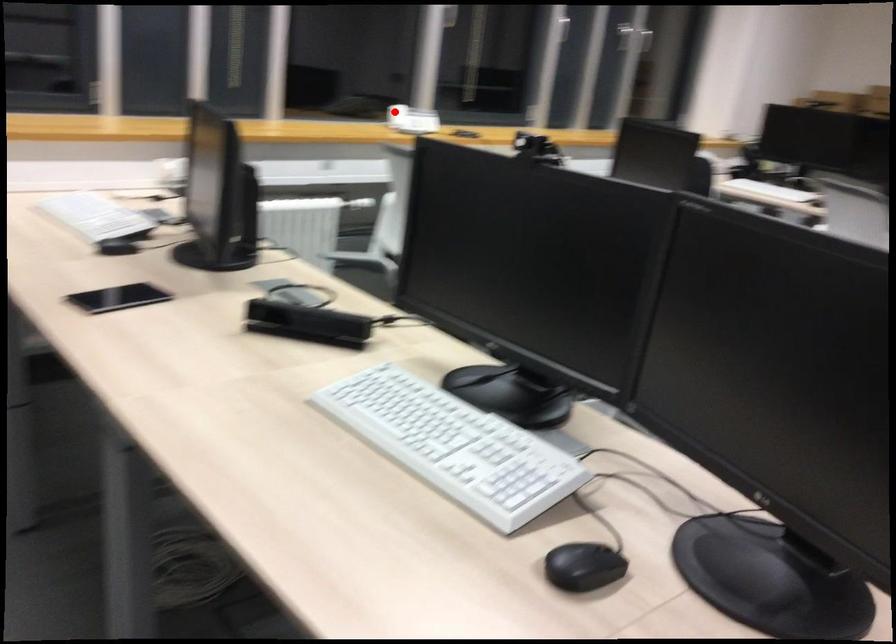
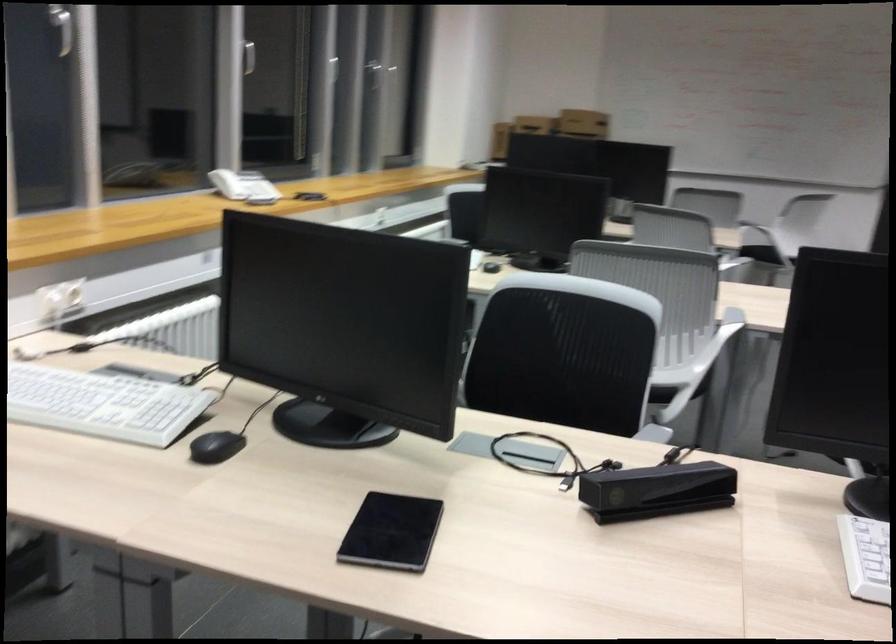
Find the pixel in the second image that matches the highlighted location in the first image.

(227, 184)